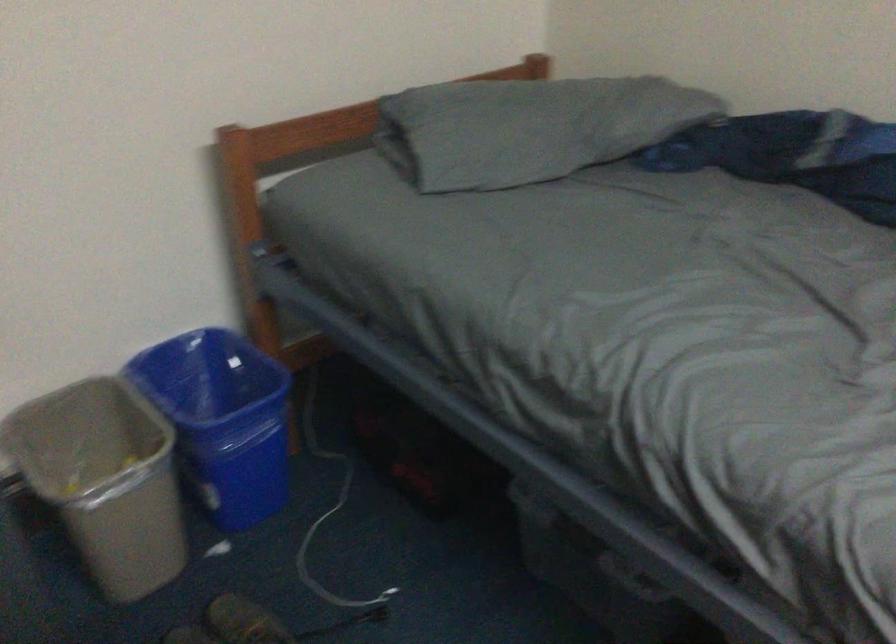
Where would you lift the grey trash can? Please return your answer as a coordinate pair (x, y).

(104, 480)